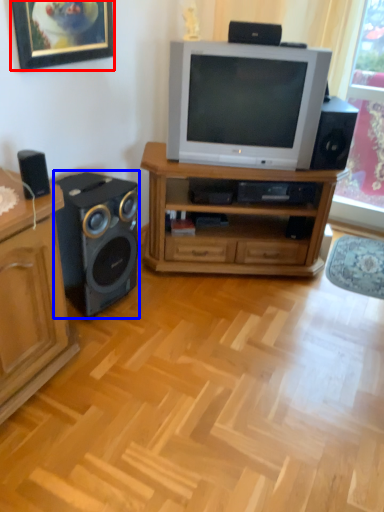
Question: Which of the following is the closest to the observer, picture frame (highlighted by a red box) or loudspeaker (highlighted by a blue box)?

Choices:
 (A) picture frame
 (B) loudspeaker

Answer: (A)